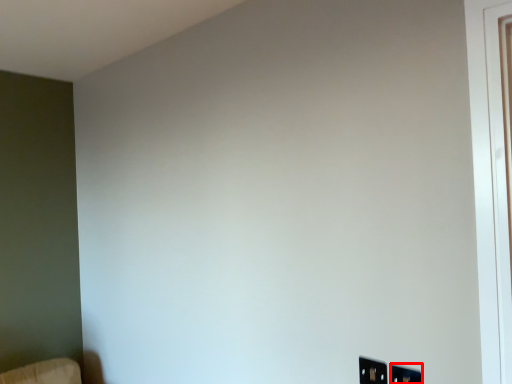
Question: From the image's perspective, considering the relative positions of electric outlet (annotated by the red box) and electric outlet in the image provided, where is electric outlet (annotated by the red box) located with respect to the staircase?

Choices:
 (A) below
 (B) above

Answer: (A)